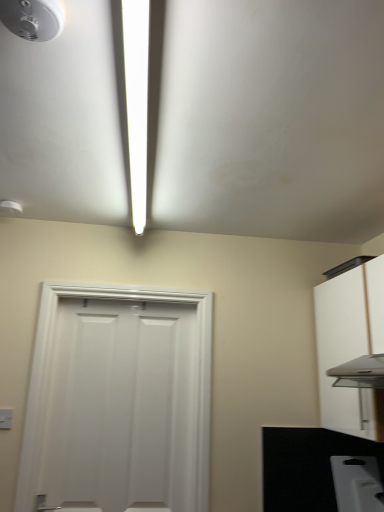
Question: Is white matte door at center at the back of white matte cabinet at right?

Choices:
 (A) no
 (B) yes

Answer: (A)

Question: Is white matte cabinet at right next to white matte door at center?

Choices:
 (A) no
 (B) yes

Answer: (A)

Question: Is white matte cabinet at right bigger than white matte door at center?

Choices:
 (A) yes
 (B) no

Answer: (A)

Question: Is white matte cabinet at right to the right of white matte door at center from the viewer's perspective?

Choices:
 (A) yes
 (B) no

Answer: (A)

Question: Is white matte cabinet at right smaller than white matte door at center?

Choices:
 (A) yes
 (B) no

Answer: (B)

Question: From the image's perspective, is black matte countertop at lower right above or below white matte door at center?

Choices:
 (A) above
 (B) below

Answer: (B)

Question: Considering the positions of black matte countertop at lower right and white matte door at center in the image, is black matte countertop at lower right bigger or smaller than white matte door at center?

Choices:
 (A) big
 (B) small

Answer: (B)

Question: Relative to white matte door at center, is black matte countertop at lower right in front or behind?

Choices:
 (A) front
 (B) behind

Answer: (B)

Question: Would you say black matte countertop at lower right is to the left or to the right of white matte door at center in the picture?

Choices:
 (A) left
 (B) right

Answer: (B)

Question: Considering the positions of white matte door at center and white plastic toaster at lower right in the image, is white matte door at center wider or thinner than white plastic toaster at lower right?

Choices:
 (A) thin
 (B) wide

Answer: (B)

Question: In the image, is white matte door at center positioned in front of or behind white plastic toaster at lower right?

Choices:
 (A) behind
 (B) front

Answer: (B)

Question: Choose the correct answer: Is white matte door at center inside white plastic toaster at lower right or outside it?

Choices:
 (A) outside
 (B) inside

Answer: (A)

Question: From the image's perspective, is white matte door at center above or below white plastic toaster at lower right?

Choices:
 (A) above
 (B) below

Answer: (A)

Question: Choose the correct answer: Is white matte door at center inside white glossy light fixture at upper center or outside it?

Choices:
 (A) outside
 (B) inside

Answer: (A)

Question: From a real-world perspective, is white matte door at center physically located above or below white glossy light fixture at upper center?

Choices:
 (A) above
 (B) below

Answer: (B)